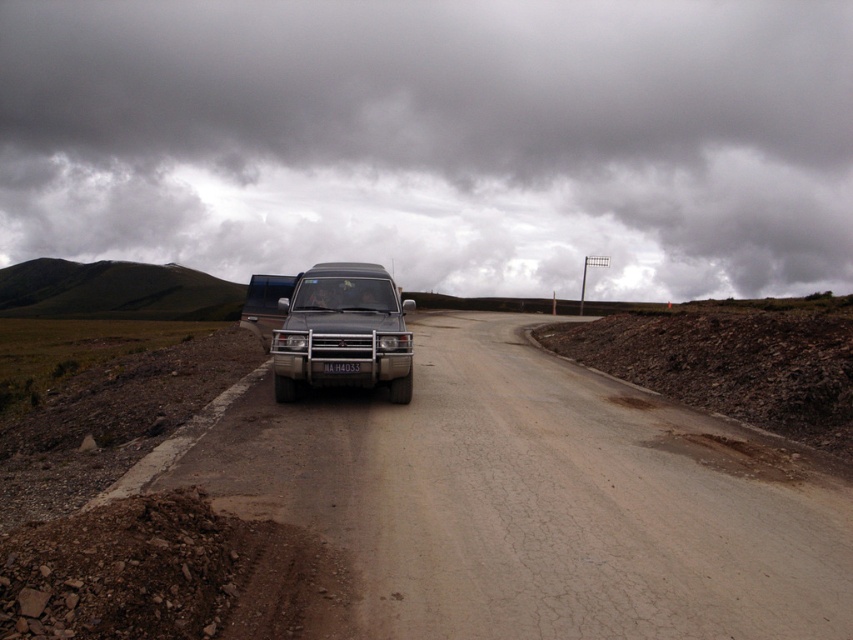
You are standing at the edge of the road and see two points marked on the road surface. The first point is at coordinates point (302, 307) and the second is at point (271, 276). Which point is closer to you?

Point (302, 307) is closer to the camera than point (271, 276), so the first point is closer to you.

You are driving a car and see the image. There is a point marked at coordinates (x=343, y=332). What is located at that point?

The point at coordinates (x=343, y=332) marks the location of the matte black jeep at center.